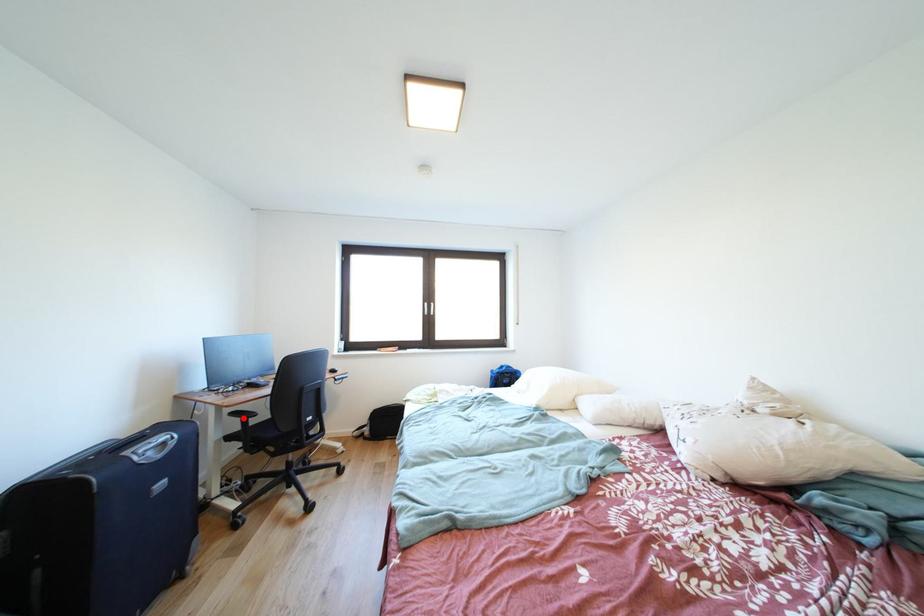
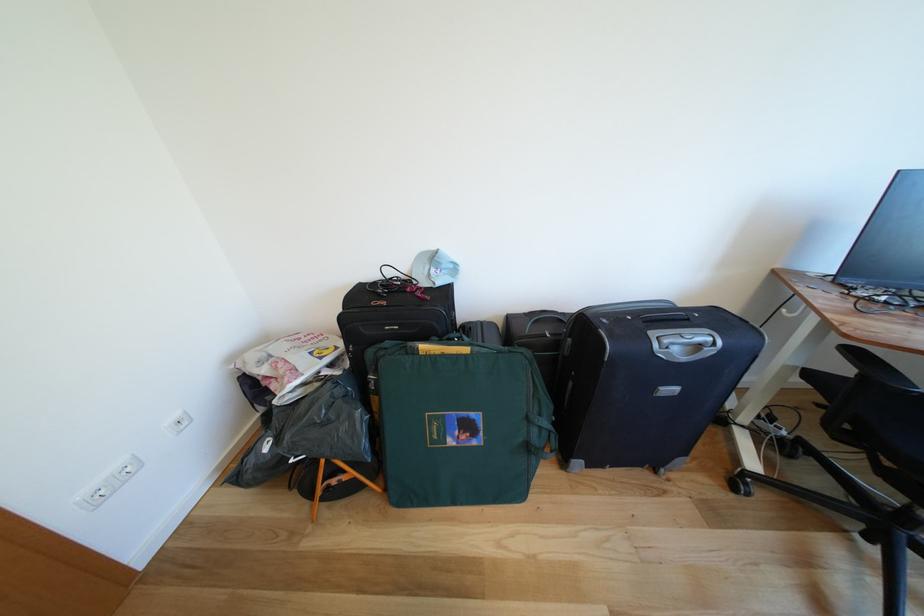
The point at the highlighted location is marked in the first image. Where is the corresponding point in the second image?

(862, 357)